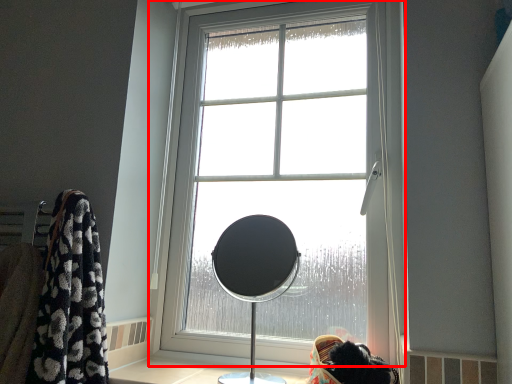
Question: From the image's perspective, where is window (annotated by the red box) located in relation to table lamp in the image?

Choices:
 (A) above
 (B) below

Answer: (A)